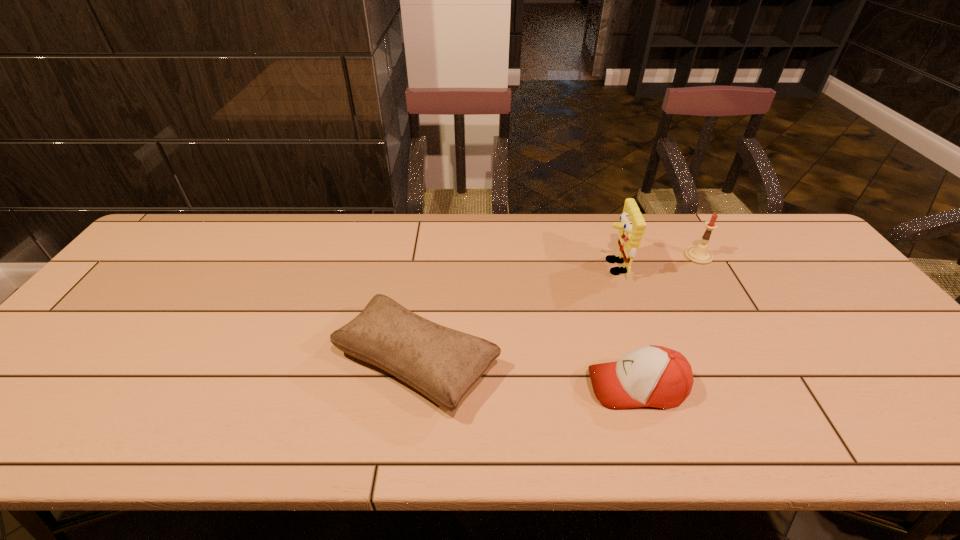
Identify the location of free space between the sponge and the baseball cap. Image resolution: width=960 pixels, height=540 pixels. (625, 327).

Find the location of a particular element. The height and width of the screenshot is (540, 960). vacant point located between the baseball cap and the third shortest object is located at coordinates (667, 321).

Locate an element on the screen. Image resolution: width=960 pixels, height=540 pixels. free space between the baseball cap and the sponge is located at coordinates (625, 327).

Find the location of `unoccupied area between the cushion and the sponge`. unoccupied area between the cushion and the sponge is located at coordinates (516, 315).

At what (x,y) coordinates should I click in order to perform the action: click on free space between the sponge and the rightmost object. Please return your answer as a coordinate pair (x, y). This screenshot has height=540, width=960. Looking at the image, I should click on (657, 261).

The width and height of the screenshot is (960, 540). What are the coordinates of `blank region between the sponge and the cushion` in the screenshot? It's located at pyautogui.click(x=516, y=315).

Image resolution: width=960 pixels, height=540 pixels. Identify the location of free space between the baseball cap and the tallest object. (625, 327).

Where is `free space between the baseball cap and the rightmost object`? free space between the baseball cap and the rightmost object is located at coordinates (667, 321).

At what (x,y) coordinates should I click in order to perform the action: click on free space between the cushion and the baseball cap. Please return your answer as a coordinate pair (x, y). This screenshot has width=960, height=540. Looking at the image, I should click on (526, 375).

Image resolution: width=960 pixels, height=540 pixels. I want to click on unoccupied position between the baseball cap and the cushion, so click(x=526, y=375).